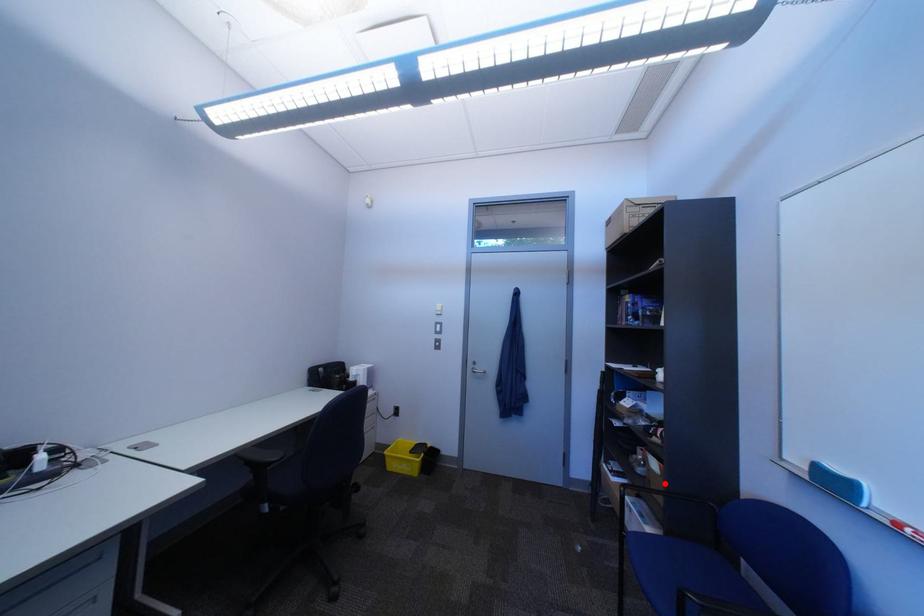
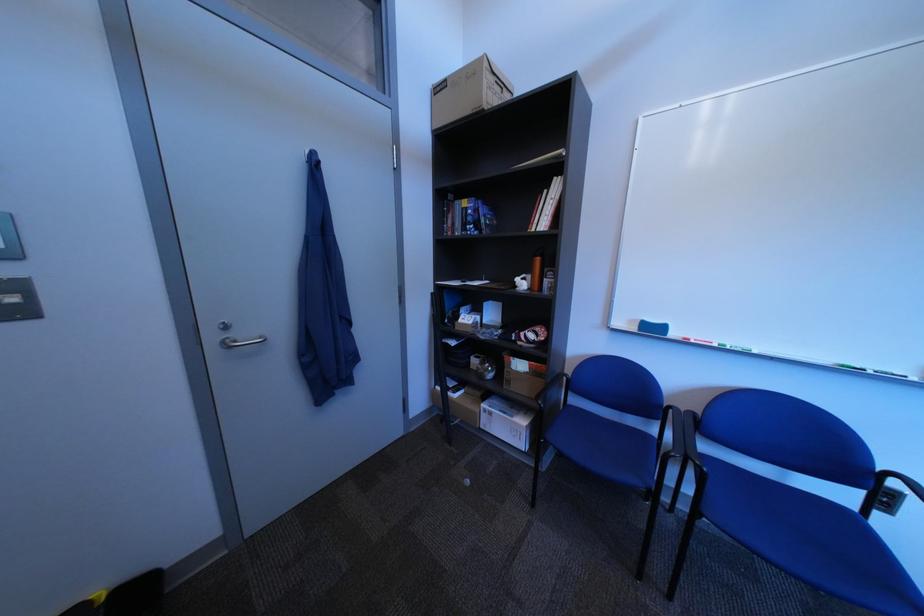
Question: I am providing you with two images of the same scene from different viewpoints. In image1, a red point is highlighted. Considering the same 3D point in image2, which of the following is correct?

Choices:
 (A) It is closer
 (B) It is farther

Answer: (B)